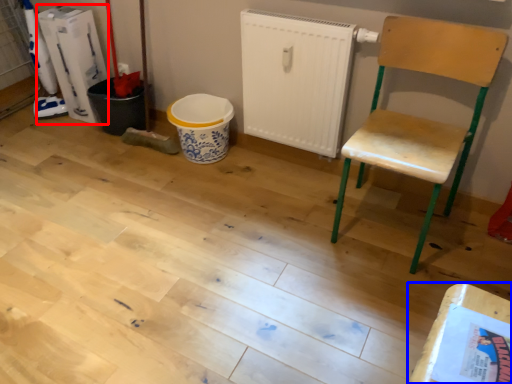
Question: Which object appears farthest to the camera in this image, appliance (highlighted by a red box) or table (highlighted by a blue box)?

Choices:
 (A) appliance
 (B) table

Answer: (A)